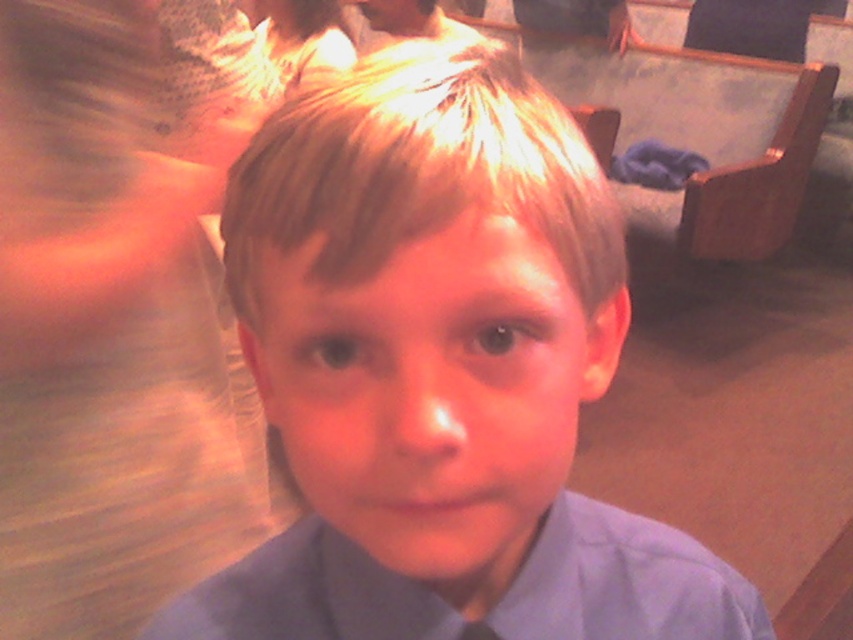
You are a tailor who needs to decide between two pieces of clothing in the image to alter. The light blue fabric at center and the matte blue dress shirt at center. Which one has a smaller width?

The light blue fabric at center has a smaller width than the matte blue dress shirt at center according to the description.

You are a photographer adjusting the camera focus. You need to ensure both the matte blue shirt at center and the blonde smooth hair at center are in focus. Given their height difference, which object should you focus on first to maximize the chances of both being sharp?

The matte blue shirt at center is much taller than the blonde smooth hair at center. To maximize focus on both, you should focus on the matte blue shirt at center first since it is taller and likely further away, ensuring depth of field covers both.

You are a photographer adjusting the focus on your camera. You want to capture both the matte blue shirt at center and the light blue fabric at center in sharp focus. The depth of field in your current setting allows objects within 25 inches of each other to be in focus. Can both objects be in focus simultaneously?

The matte blue shirt at center and the light blue fabric at center are 28.42 inches apart from each other. Since the depth of field only allows objects within 25 inches to be in focus, they cannot both be in focus at the same time.